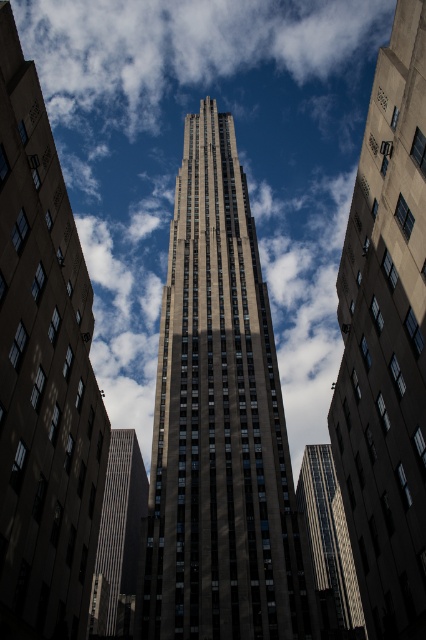
Can you confirm if white fluffy cloud at center is positioned to the right of brown stone tower at center?

In fact, white fluffy cloud at center is to the left of brown stone tower at center.

Does point (296, 307) lie in front of point (267, 403)?

No, it is not.

The height and width of the screenshot is (640, 426). Identify the location of white fluffy cloud at center. (180, 163).

Between white fluffy cloud at center and dark gray stone tower at center, which one has less height?

dark gray stone tower at center

Can you confirm if white fluffy cloud at center is positioned to the right of dark gray stone tower at center?

In fact, white fluffy cloud at center is to the left of dark gray stone tower at center.

Does point (127, 64) come farther from viewer compared to point (2, 588)?

Yes, point (127, 64) is behind point (2, 588).

What are the coordinates of `white fluffy cloud at center` in the screenshot? It's located at (180, 163).

Can you confirm if brown stone skyscraper at center is taller than reflective glass skyscraper at center?

In fact, brown stone skyscraper at center may be shorter than reflective glass skyscraper at center.

Is point (394, 45) farther from camera compared to point (334, 532)?

No, (394, 45) is closer to viewer.

Which is behind, point (423, 200) or point (316, 573)?

The point (316, 573) is behind.

You are a GUI agent. You are given a task and a screenshot of the screen. Output one action in this format:
    pyautogui.click(x=<x>, y=<y>)
    Task: Click on the brown stone skyscraper at center
    
    Given the screenshot: What is the action you would take?
    pyautogui.click(x=386, y=342)